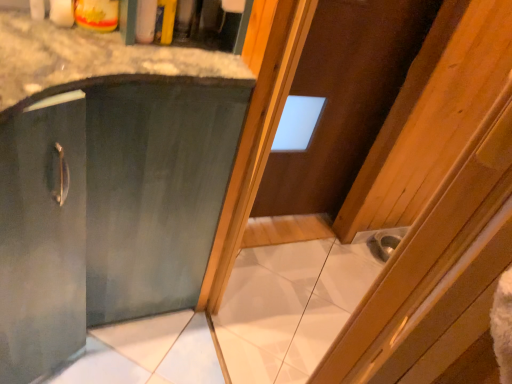
Question: Would you consider metallic silver sink at lower right to be distant from matte green cabinet at center?

Choices:
 (A) yes
 (B) no

Answer: (A)

Question: From a real-world perspective, is metallic silver sink at lower right beneath matte green cabinet at center?

Choices:
 (A) no
 (B) yes

Answer: (B)

Question: Does metallic silver sink at lower right have a lesser height compared to matte green cabinet at center?

Choices:
 (A) no
 (B) yes

Answer: (B)

Question: Can you confirm if metallic silver sink at lower right is wider than matte green cabinet at center?

Choices:
 (A) no
 (B) yes

Answer: (A)

Question: Can we say metallic silver sink at lower right lies outside matte green cabinet at center?

Choices:
 (A) yes
 (B) no

Answer: (A)

Question: Does metallic silver sink at lower right have a larger size compared to matte green cabinet at center?

Choices:
 (A) yes
 (B) no

Answer: (B)

Question: Is brown wooden door at upper center positioned far away from matte green cabinet at center?

Choices:
 (A) yes
 (B) no

Answer: (B)

Question: Considering the relative sizes of brown wooden door at upper center and matte green cabinet at center in the image provided, is brown wooden door at upper center wider than matte green cabinet at center?

Choices:
 (A) yes
 (B) no

Answer: (B)

Question: Is brown wooden door at upper center turned away from matte green cabinet at center?

Choices:
 (A) no
 (B) yes

Answer: (A)

Question: Can you see brown wooden door at upper center touching matte green cabinet at center?

Choices:
 (A) yes
 (B) no

Answer: (B)

Question: Is brown wooden door at upper center taller than matte green cabinet at center?

Choices:
 (A) yes
 (B) no

Answer: (A)

Question: Does brown wooden door at upper center have a lesser height compared to matte green cabinet at center?

Choices:
 (A) yes
 (B) no

Answer: (B)

Question: From a real-world perspective, is metallic silver sink at lower right positioned over brown wooden door at upper center based on gravity?

Choices:
 (A) yes
 (B) no

Answer: (B)